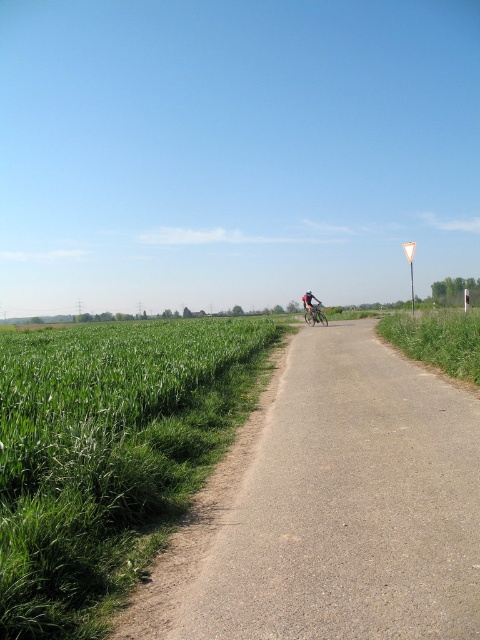
Question: Estimate the real-world distances between objects in this image. Which object is farther from the asphalt road at center?

Choices:
 (A) green grassy field at left
 (B) shiny metallic bicycle at center

Answer: (B)

Question: Estimate the real-world distances between objects in this image. Which object is closer to the shiny metallic bicycle at center?

Choices:
 (A) asphalt road at center
 (B) green grassy field at left

Answer: (B)

Question: Which point appears farthest from the camera in this image?

Choices:
 (A) (404, 532)
 (B) (68, 516)

Answer: (A)

Question: Does asphalt road at center come in front of shiny metallic bicycle at center?

Choices:
 (A) no
 (B) yes

Answer: (B)

Question: Does green grassy field at left appear on the left side of shiny metallic bicycle at center?

Choices:
 (A) no
 (B) yes

Answer: (B)

Question: Is asphalt road at center below green grassy field at left?

Choices:
 (A) yes
 (B) no

Answer: (A)